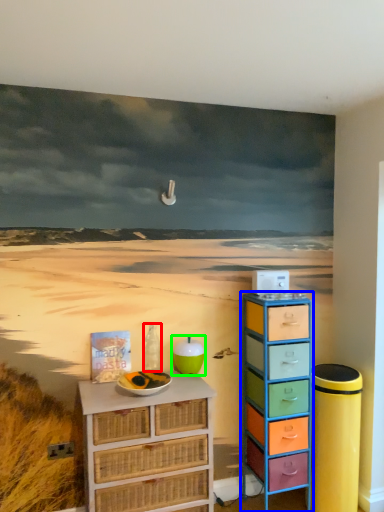
Question: Estimate the real-world distances between objects in this image. Which object is farther from bottle (highlighted by a red box), chest of drawers (highlighted by a blue box) or teal (highlighted by a green box)?

Choices:
 (A) chest of drawers
 (B) teal

Answer: (A)